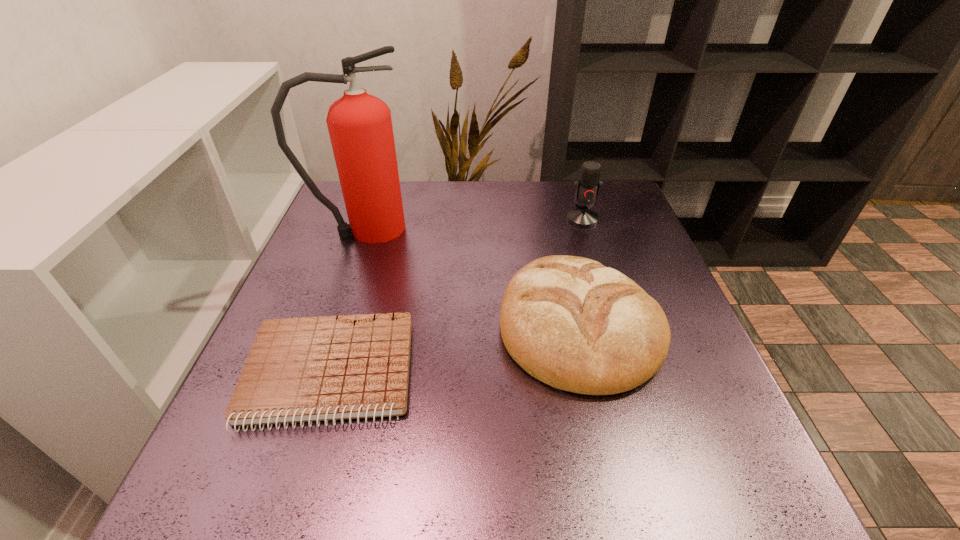
In order to click on object that stands as the closest to the bread in this screenshot , I will do `click(306, 369)`.

The image size is (960, 540). I want to click on blank area in the image that satisfies the following two spatial constraints: 1. on the back side of the notebook; 2. on the handle side of the tallest object, so click(374, 228).

Identify the location of vacant position in the image that satisfies the following two spatial constraints: 1. on the side of the microphone with the red ring; 2. on the handle side of the tallest object. (586, 228).

This screenshot has height=540, width=960. Find the location of `free region that satisfies the following two spatial constraints: 1. on the side of the microphone with the red ring; 2. on the handle side of the tallest object`. free region that satisfies the following two spatial constraints: 1. on the side of the microphone with the red ring; 2. on the handle side of the tallest object is located at coordinates (586, 228).

Image resolution: width=960 pixels, height=540 pixels. What are the coordinates of `vacant space that satisfies the following two spatial constraints: 1. on the side of the microphone with the red ring; 2. on the handle side of the tallest object` in the screenshot? It's located at (586, 228).

Where is `vacant space that satisfies the following two spatial constraints: 1. on the handle side of the fire extinguisher; 2. on the right side of the shortest object`? vacant space that satisfies the following two spatial constraints: 1. on the handle side of the fire extinguisher; 2. on the right side of the shortest object is located at coordinates (315, 373).

Where is `vacant space that satisfies the following two spatial constraints: 1. on the handle side of the tallest object; 2. on the right side of the shortest object`? vacant space that satisfies the following two spatial constraints: 1. on the handle side of the tallest object; 2. on the right side of the shortest object is located at coordinates (315, 373).

At what (x,y) coordinates should I click in order to perform the action: click on free space in the image that satisfies the following two spatial constraints: 1. on the handle side of the shortest object; 2. on the right side of the fire extinguisher. Please return your answer as a coordinate pair (x, y). This screenshot has height=540, width=960. Looking at the image, I should click on (315, 373).

Find the location of a particular element. This screenshot has height=540, width=960. vacant region that satisfies the following two spatial constraints: 1. on the handle side of the bread; 2. on the left side of the fire extinguisher is located at coordinates (331, 326).